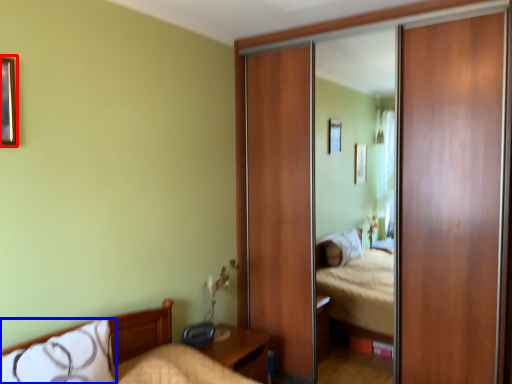
Question: Which object is further to the camera taking this photo, picture frame (highlighted by a red box) or pillow (highlighted by a blue box)?

Choices:
 (A) picture frame
 (B) pillow

Answer: (A)